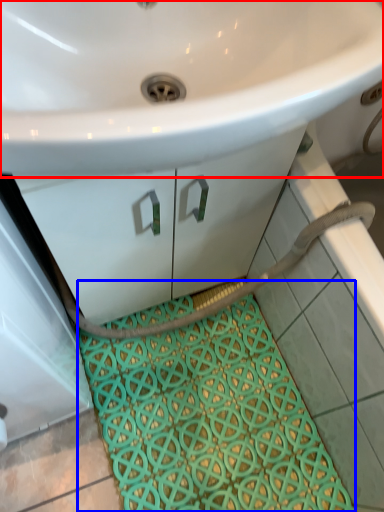
Question: Which object is further to the camera taking this photo, sink (highlighted by a red box) or bath mat (highlighted by a blue box)?

Choices:
 (A) sink
 (B) bath mat

Answer: (B)